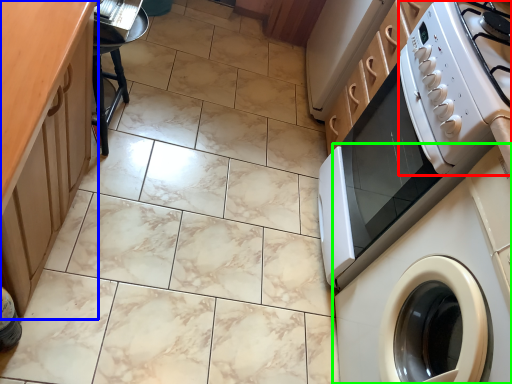
Question: Which is nearer to the gas stove (highlighted by a red box)? counter top (highlighted by a blue box) or washing machine (highlighted by a green box).

Choices:
 (A) counter top
 (B) washing machine

Answer: (B)